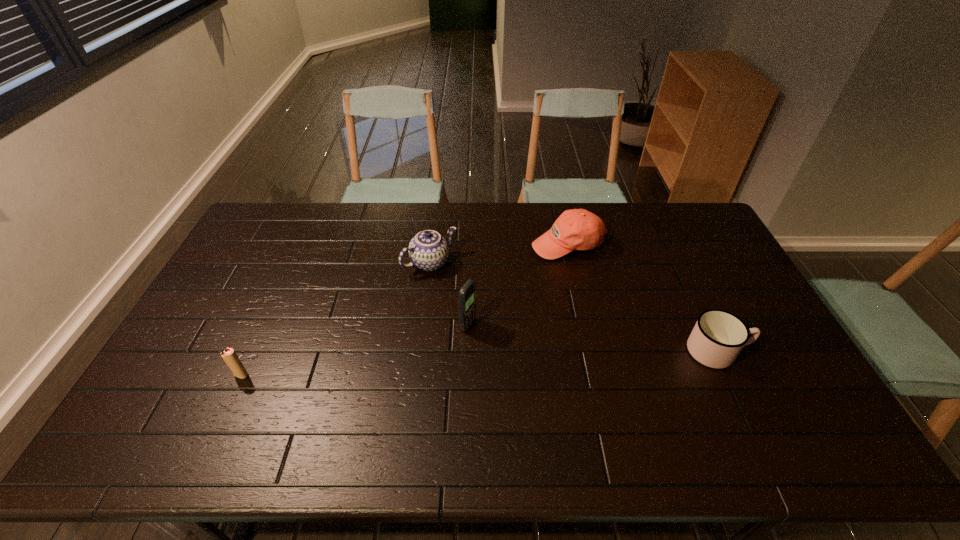
Where is `vacant space at the near edge of the desktop`? Image resolution: width=960 pixels, height=540 pixels. vacant space at the near edge of the desktop is located at coordinates (578, 400).

The height and width of the screenshot is (540, 960). Identify the location of free space at the left edge of the desktop. (207, 311).

Find the location of a particular element. The image size is (960, 540). vacant region at the right edge of the desktop is located at coordinates (701, 258).

This screenshot has height=540, width=960. Identify the location of free spot at the near right corner of the desktop. (794, 402).

The height and width of the screenshot is (540, 960). Identify the location of unoccupied area between the igniter and the second object from left to right. (336, 319).

The image size is (960, 540). In order to click on vacant space that is in between the leftmost object and the tallest object in this screenshot , I will do `click(354, 350)`.

Identify the location of free point between the second object from right to left and the leftmost object. The width and height of the screenshot is (960, 540). (404, 309).

Identify the location of vacant area between the cellular telephone and the leftmost object. The height and width of the screenshot is (540, 960). (354, 350).

Image resolution: width=960 pixels, height=540 pixels. Identify the location of empty space between the chinaware and the fourth object from left to right. (498, 253).

This screenshot has width=960, height=540. What are the coordinates of `unoccupied area between the second object from left to right and the second object from right to left` in the screenshot? It's located at (498, 253).